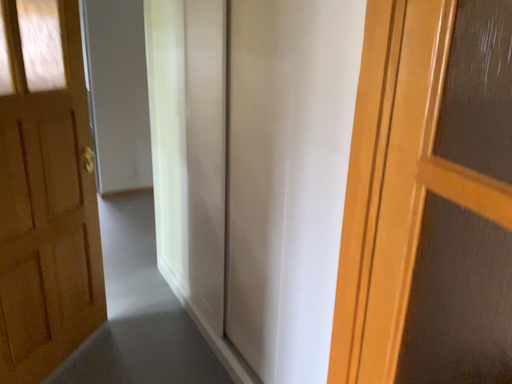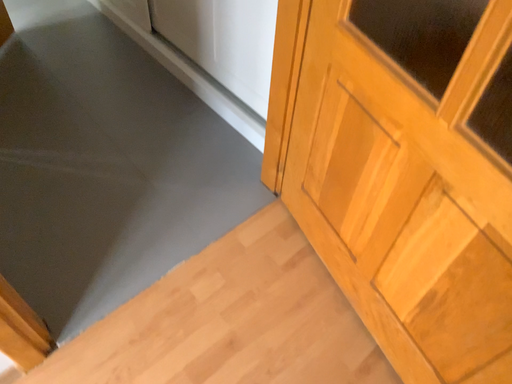
Question: How did the camera likely rotate when shooting the video?

Choices:
 (A) rotated downward
 (B) rotated upward

Answer: (A)